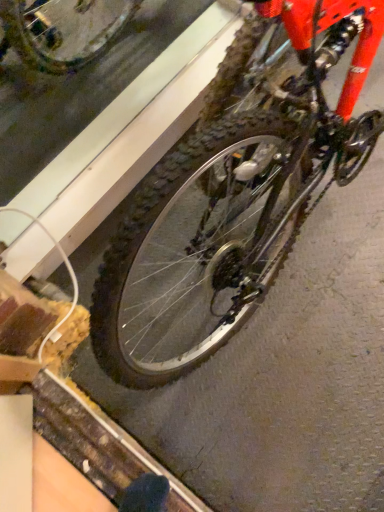
Find the location of `shiny metallic bicycle at center`. shiny metallic bicycle at center is located at coordinates (234, 190).

The width and height of the screenshot is (384, 512). What do you see at coordinates (234, 190) in the screenshot?
I see `shiny metallic bicycle at center` at bounding box center [234, 190].

Identify the location of shiny metallic bicycle at center. (234, 190).